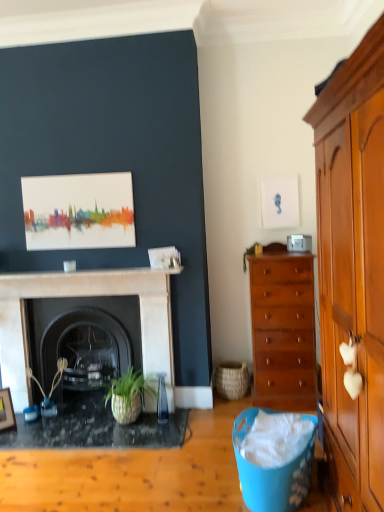
This screenshot has height=512, width=384. I want to click on blank space situated above black marble fireplace at center, the second fireplace positioned from the back (from a real-world perspective), so click(x=78, y=279).